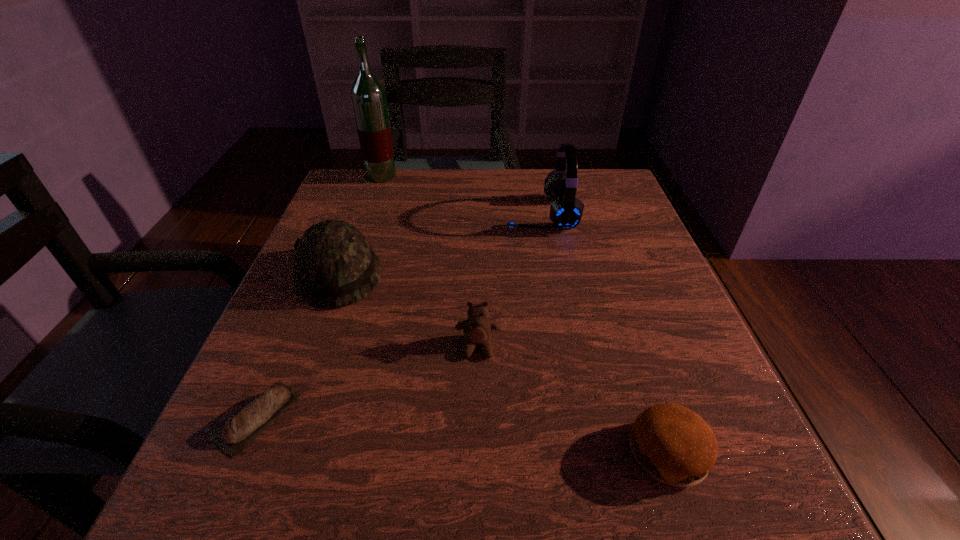
This screenshot has width=960, height=540. In order to click on liquor that is at the left edge in this screenshot , I will do `click(368, 96)`.

The width and height of the screenshot is (960, 540). What are the coordinates of `headwear located in the left edge section of the desktop` in the screenshot? It's located at (335, 266).

The width and height of the screenshot is (960, 540). What are the coordinates of `pita bread positioned at the left edge` in the screenshot? It's located at (239, 431).

The width and height of the screenshot is (960, 540). What are the coordinates of `headset present at the right edge` in the screenshot? It's located at (566, 210).

Locate an element on the screen. The image size is (960, 540). hamburger that is at the right edge is located at coordinates (672, 443).

Where is `object that is at the far left corner`? object that is at the far left corner is located at coordinates (368, 96).

Identify the location of object located at the far right corner. (566, 210).

This screenshot has width=960, height=540. I want to click on object present at the near right corner, so click(672, 443).

The height and width of the screenshot is (540, 960). I want to click on vacant space at the far edge, so click(487, 200).

Identify the location of blank space at the near edge of the desktop. This screenshot has width=960, height=540. (505, 505).